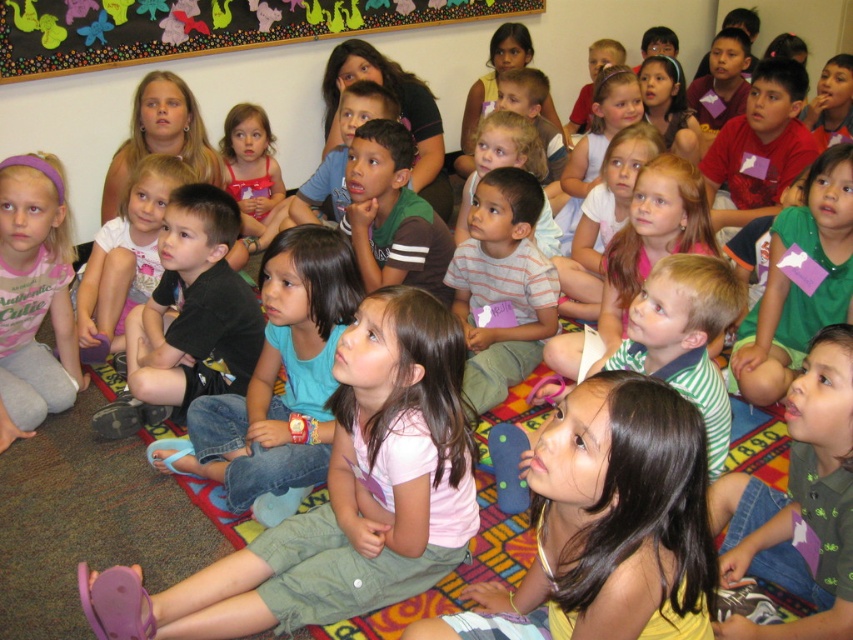
Question: Does dark brown hair at center have a larger size compared to striped cotton shirt at center?

Choices:
 (A) yes
 (B) no

Answer: (A)

Question: Among these points, which one is nearest to the camera?

Choices:
 (A) (828, 330)
 (B) (625, 410)
 (C) (106, 67)
 (D) (498, 372)

Answer: (B)

Question: Does multicolored paper butterflies at upper center lie behind striped cotton shirt at center?

Choices:
 (A) yes
 (B) no

Answer: (A)

Question: Among these objects, which one is nearest to the camera?

Choices:
 (A) multicolored paper butterflies at upper center
 (B) striped cotton shirt at center

Answer: (B)

Question: Is pink cotton shirt at center wider than multicolored paper butterflies at upper center?

Choices:
 (A) no
 (B) yes

Answer: (A)

Question: Which is nearer to the green striped shirt at lower right?

Choices:
 (A) dark brown hair at center
 (B) pink cotton shirt at center
 (C) multicolored paper butterflies at upper center

Answer: (A)